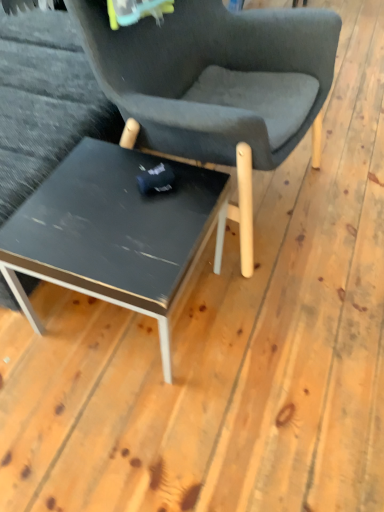
The image size is (384, 512). What do you see at coordinates (114, 232) in the screenshot?
I see `matte black table at center` at bounding box center [114, 232].

At what (x,y) coordinates should I click in order to perform the action: click on matte black table at center. Please return your answer as a coordinate pair (x, y). The height and width of the screenshot is (512, 384). Looking at the image, I should click on (114, 232).

Looking at this image, in order to face matte black table at center, should I rotate leftwards or rightwards?

To face it directly, rotate left by 8.626 degrees.

Measure the distance between point (91, 147) and camera.

The distance of point (91, 147) from camera is 1.22 meters.

Find the location of a particular element. The image size is (384, 512). matte black chair at center is located at coordinates (216, 77).

Measure the distance between matte black chair at center and camera.

1.02 meters.

What do you see at coordinates (216, 77) in the screenshot? This screenshot has height=512, width=384. I see `matte black chair at center` at bounding box center [216, 77].

The image size is (384, 512). I want to click on matte black table at center, so click(x=114, y=232).

Between matte black table at center and matte black chair at center, which one appears on the right side from the viewer's perspective?

Result: matte black chair at center is more to the right.

Does matte black table at center come in front of matte black chair at center?

No, the depth of matte black table at center is greater than that of matte black chair at center.

Between point (7, 246) and point (123, 81), which one is positioned in front?

Point (7, 246)

From the image's perspective, which one is positioned higher, matte black table at center or matte black chair at center?

From the image's view, matte black chair at center is above.

From a real-world perspective, which is physically above, matte black table at center or matte black chair at center?

In real-world perspective, matte black chair at center is above.

Between matte black table at center and matte black chair at center, which one has smaller width?

With smaller width is matte black table at center.

Which of these two, matte black table at center or matte black chair at center, stands shorter?

Standing shorter between the two is matte black table at center.

Is matte black table at center smaller than matte black chair at center?

Yes, matte black table at center is smaller than matte black chair at center.

Is matte black chair at center located within matte black table at center?

That's incorrect, matte black chair at center is not inside matte black table at center.

In the scene shown: Is matte black table at center not near matte black chair at center?

No.

Does matte black table at center turn towards matte black chair at center?

Yes, matte black table at center is aimed at matte black chair at center.

Where is `chair on the right of matte black table at center`? Image resolution: width=384 pixels, height=512 pixels. chair on the right of matte black table at center is located at coordinates (216, 77).

Between matte black chair at center and matte black table at center, which one appears on the left side from the viewer's perspective?

Positioned to the left is matte black table at center.

Which object is further away from the camera taking this photo, matte black chair at center or matte black table at center?

matte black table at center.

Is point (271, 54) closer to viewer compared to point (166, 362)?

No.

From the image's perspective, which object appears higher, matte black chair at center or matte black table at center?

matte black chair at center.

From a real-world perspective, does matte black chair at center stand above matte black table at center?

Correct, in the physical world, matte black chair at center is higher than matte black table at center.

Can you confirm if matte black chair at center is thinner than matte black table at center?

In fact, matte black chair at center might be wider than matte black table at center.

Is matte black chair at center taller or shorter than matte black table at center?

In the image, matte black chair at center appears to be taller than matte black table at center.

Based on their sizes in the image, would you say matte black chair at center is bigger or smaller than matte black table at center?

matte black chair at center is bigger than matte black table at center.

In the scene shown: Is matte black table at center completely or partially inside matte black chair at center?

Definitely not — matte black table at center is not inside matte black chair at center.

Is matte black chair at center not close to matte black table at center?

No, matte black chair at center is not far away from matte black table at center.

Is matte black chair at center positioned with its back to matte black table at center?

That's not correct — matte black chair at center is not looking away from matte black table at center.

How different are the orientations of matte black chair at center and matte black table at center in degrees?

The angular difference between matte black chair at center and matte black table at center is 97 degrees.

Locate an element on the screen. The width and height of the screenshot is (384, 512). chair on the right of the matte black table at center is located at coordinates (216, 77).

I want to click on chair above the matte black table at center (from a real-world perspective), so click(x=216, y=77).

Where is `coffee table located below the matte black chair at center (from the image's perspective)`? coffee table located below the matte black chair at center (from the image's perspective) is located at coordinates (114, 232).